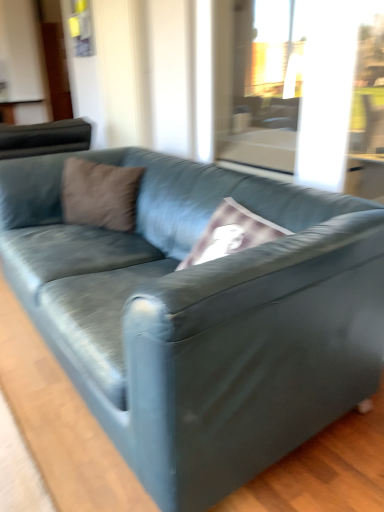
Question: Considering the positions of suede blue couch at center and brown suede pillow at upper left in the image, is suede blue couch at center bigger or smaller than brown suede pillow at upper left?

Choices:
 (A) small
 (B) big

Answer: (B)

Question: From the image's perspective, is suede blue couch at center positioned above or below brown suede pillow at upper left?

Choices:
 (A) below
 (B) above

Answer: (A)

Question: Is point (180, 280) positioned closer to the camera than point (66, 192)?

Choices:
 (A) closer
 (B) farther

Answer: (A)

Question: Considering their positions, is brown suede pillow at upper left located in front of or behind suede blue couch at center?

Choices:
 (A) behind
 (B) front

Answer: (A)

Question: Is brown suede pillow at upper left to the left or to the right of suede blue couch at center in the image?

Choices:
 (A) left
 (B) right

Answer: (A)

Question: Is point (67, 186) closer or farther from the camera than point (8, 167)?

Choices:
 (A) closer
 (B) farther

Answer: (B)

Question: Is brown suede pillow at upper left wider or thinner than suede blue couch at center?

Choices:
 (A) wide
 (B) thin

Answer: (B)